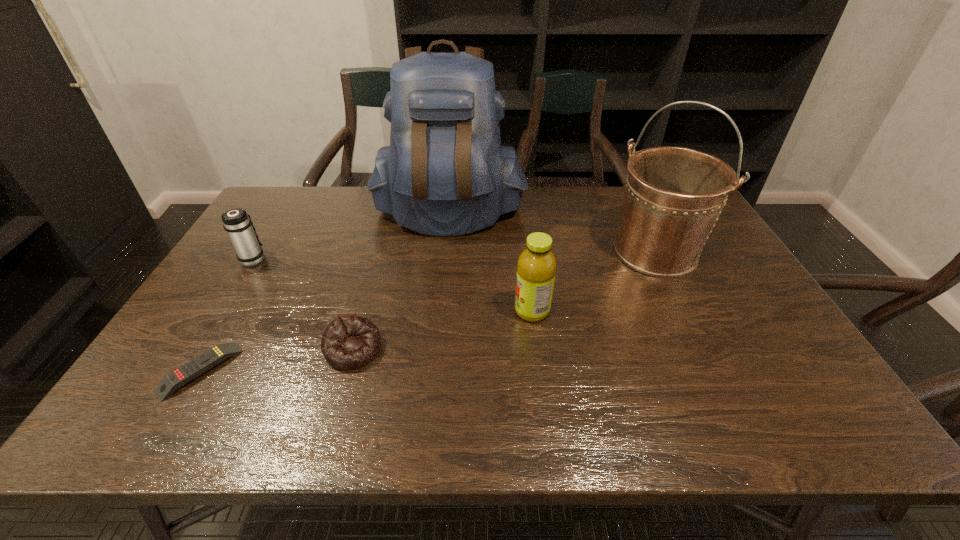
This screenshot has width=960, height=540. I want to click on remote control positioned at the left edge, so click(182, 375).

The width and height of the screenshot is (960, 540). Identify the location of object that is at the right edge. pyautogui.click(x=674, y=195).

Where is `object located in the near left corner section of the desktop`? object located in the near left corner section of the desktop is located at coordinates (182, 375).

Image resolution: width=960 pixels, height=540 pixels. Identify the location of vacant region at the far edge. (360, 211).

Locate an element on the screen. vacant space at the near edge of the desktop is located at coordinates (281, 419).

You are a GUI agent. You are given a task and a screenshot of the screen. Output one action in this format:
    pyautogui.click(x=<x>, y=<y>)
    Task: Click on the free space at the left edge of the desktop
    This screenshot has width=960, height=540.
    Given the screenshot: What is the action you would take?
    pyautogui.click(x=273, y=230)

At what (x,y) coordinates should I click in order to perform the action: click on free space at the right edge of the desktop. Please return your answer as a coordinate pair (x, y). This screenshot has width=960, height=540. Looking at the image, I should click on (780, 372).

Locate an element on the screen. The width and height of the screenshot is (960, 540). free space at the far left corner is located at coordinates (271, 216).

Find the location of a particular element. Image resolution: width=960 pixels, height=540 pixels. free spot at the near left corner of the desktop is located at coordinates (171, 410).

Image resolution: width=960 pixels, height=540 pixels. I want to click on vacant space that's between the backpack and the remote control, so click(x=324, y=291).